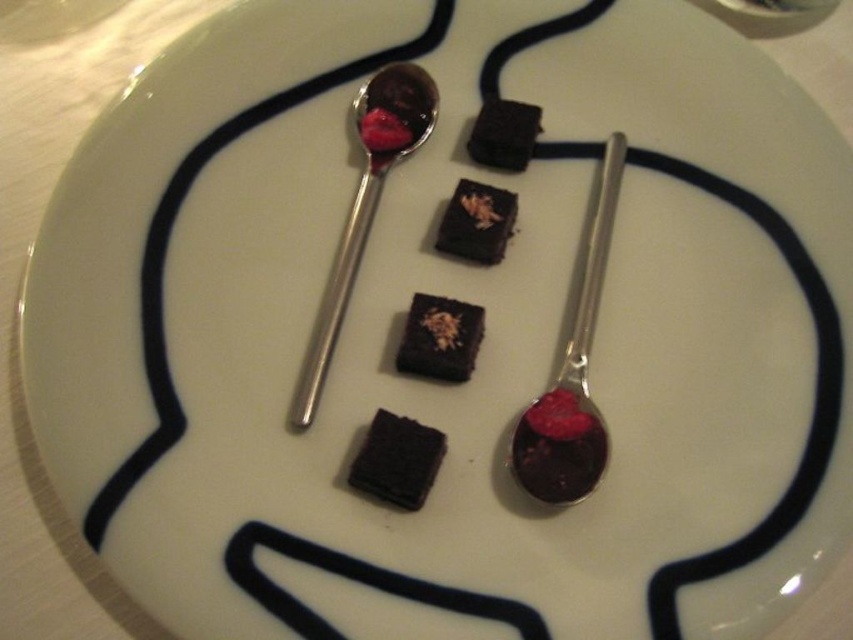
You have a small container that can only hold items narrower than the dark matte chocolate cake at center. Can the silver metallic spoon at center fit into the container?

The silver metallic spoon at center is wider than the dark matte chocolate cake at center, so it cannot fit into the container designed for items narrower than the cake.

You are a chef preparing a dessert plating. You have a shiny metal spoon at center right and a chocolate matte at center. Which object is larger in size?

The shiny metal spoon at center right is bigger than the chocolate matte at center.